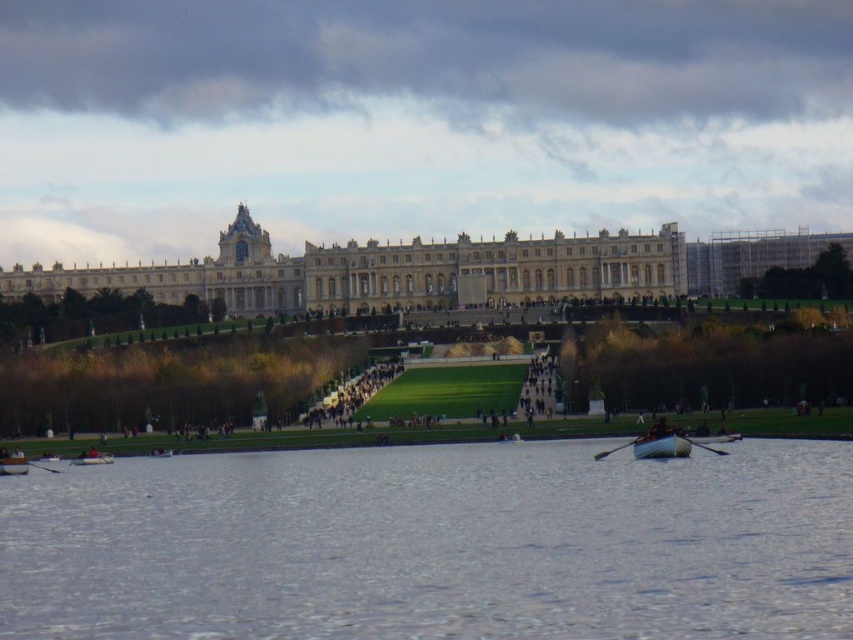
You are planning to take a photo of the clear water at lower center and the wooden rowboat at lower left from the hill where the building stands. Which object will appear larger in your photo?

The clear water at lower center will appear larger in the photo because it is larger in size than the wooden rowboat at lower left.